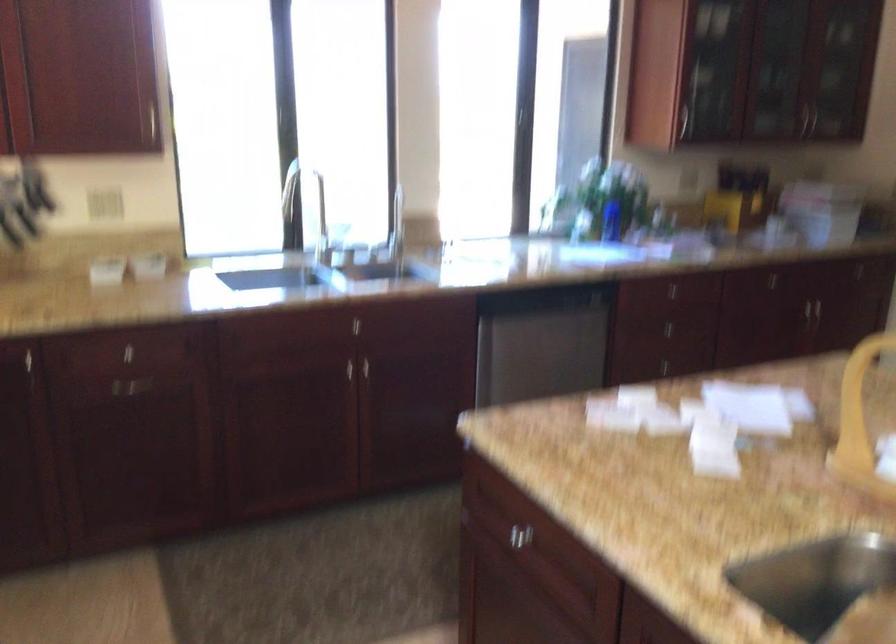
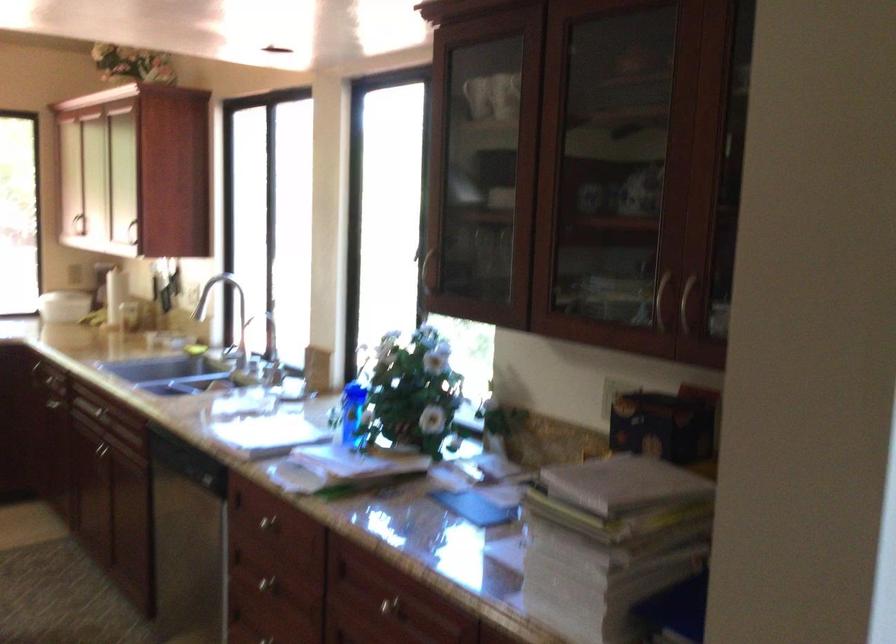
Locate, in the second image, the point that corresponds to (694,319) in the first image.

(266, 583)